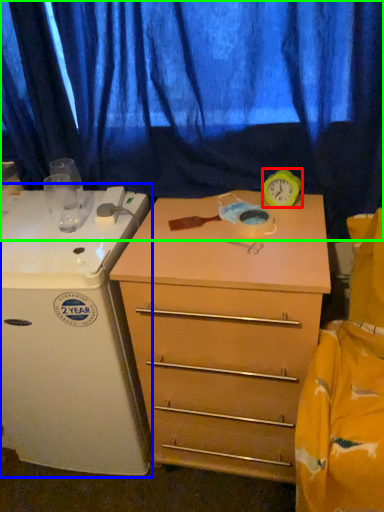
Question: Based on their relative distances, which object is farther from clock (highlighted by a red box)? Choose from appliance (highlighted by a blue box) and curtain (highlighted by a green box).

Choices:
 (A) appliance
 (B) curtain

Answer: (A)